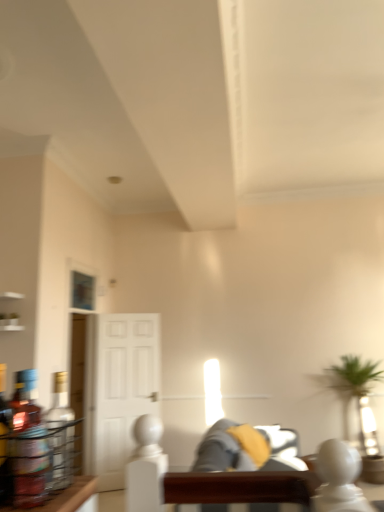
Question: Should I look upward or downward to see translucent glass bottle at left, placed as the 1th bottle when sorted from front to back?

Choices:
 (A) down
 (B) up

Answer: (A)

Question: Can we say white glossy door at center lies outside translucent glass bottle at left, the second bottle in the front-to-back sequence?

Choices:
 (A) yes
 (B) no

Answer: (A)

Question: From the image's perspective, is white glossy door at center over translucent glass bottle at left, the 1th bottle from the back?

Choices:
 (A) yes
 (B) no

Answer: (B)

Question: Can you confirm if white glossy door at center is smaller than translucent glass bottle at left, the 1th bottle from the back?

Choices:
 (A) yes
 (B) no

Answer: (B)

Question: From a real-world perspective, is white glossy door at center physically below translucent glass bottle at left, the second bottle in the front-to-back sequence?

Choices:
 (A) no
 (B) yes

Answer: (B)

Question: Can you confirm if white glossy door at center is shorter than translucent glass bottle at left, the second bottle in the front-to-back sequence?

Choices:
 (A) yes
 (B) no

Answer: (B)

Question: Is translucent glass bottle at left, the second bottle in the front-to-back sequence, surrounded by white glossy door at center?

Choices:
 (A) no
 (B) yes

Answer: (A)

Question: From a real-world perspective, is translucent glass bottle at left, the 1th bottle from the back, positioned over white glossy door at center based on gravity?

Choices:
 (A) no
 (B) yes

Answer: (B)

Question: Is translucent glass bottle at left, the second bottle in the front-to-back sequence, taller than white glossy door at center?

Choices:
 (A) yes
 (B) no

Answer: (B)

Question: Can you confirm if translucent glass bottle at left, the 1th bottle from the back, is thinner than white glossy door at center?

Choices:
 (A) no
 (B) yes

Answer: (B)

Question: Is translucent glass bottle at left, the 1th bottle from the back, with white glossy door at center?

Choices:
 (A) no
 (B) yes

Answer: (A)

Question: From a real-world perspective, is translucent glass bottle at left, the second bottle in the front-to-back sequence, under white glossy door at center?

Choices:
 (A) yes
 (B) no

Answer: (B)

Question: Does translucent glass bottle at left, the 1th bottle from the back, have a smaller size compared to white glossy door at center?

Choices:
 (A) yes
 (B) no

Answer: (A)

Question: Is translucent glass bottle at left, placed as the 1th bottle when sorted from front to back, closer to camera compared to soft gray fabric couch at center, positioned as the second couch in back-to-front order?

Choices:
 (A) yes
 (B) no

Answer: (A)